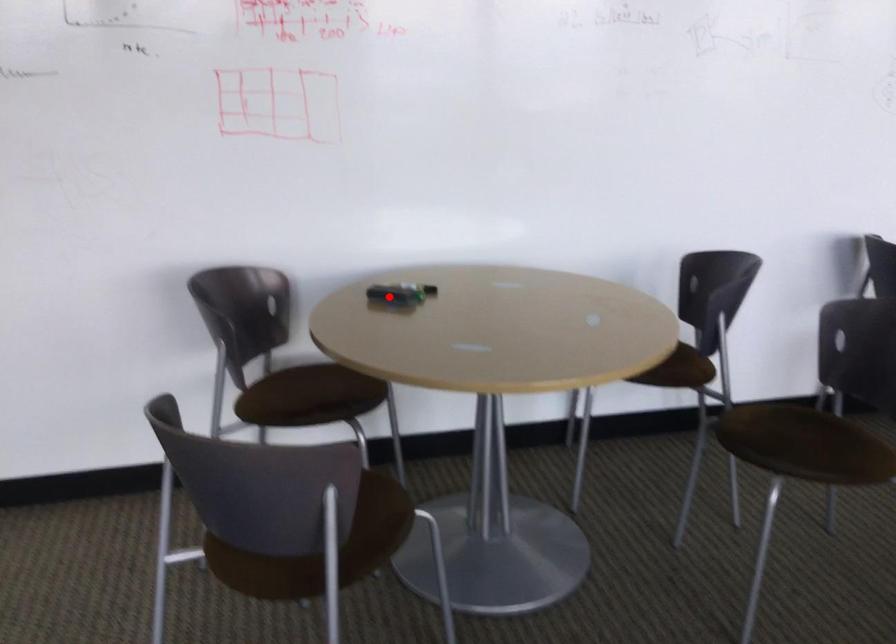
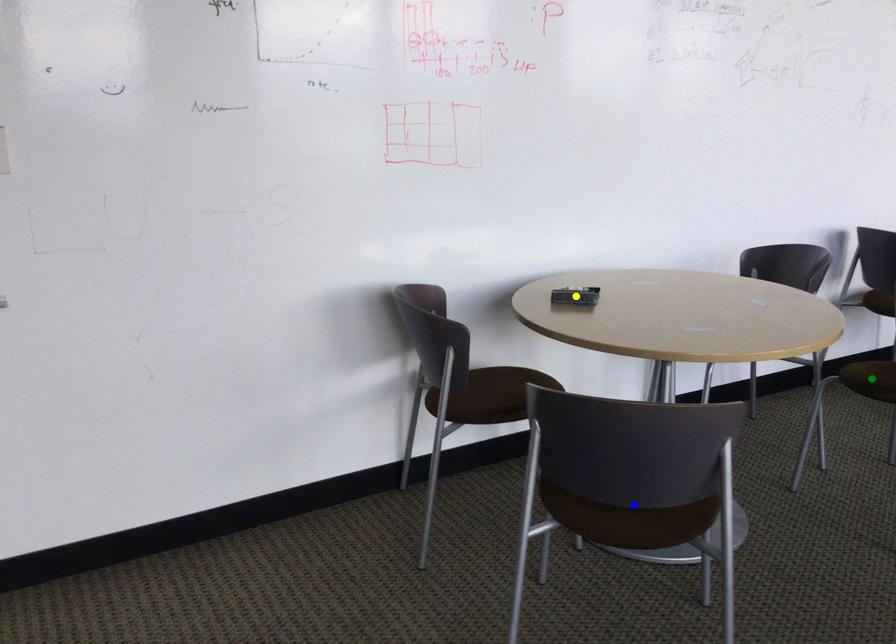
Question: I am providing you with two images of the same scene from different viewpoints. A red point is marked on the first image. You are given multiple points on the second image. Which spot in image 2 lines up with the point in image 1?

Choices:
 (A) blue point
 (B) yellow point
 (C) green point

Answer: (B)